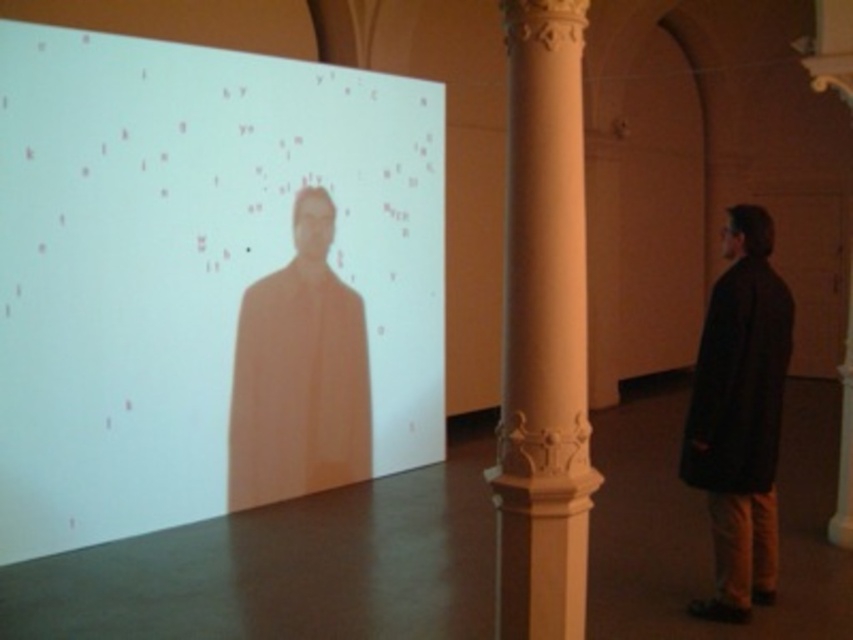
Question: Which object is farther from the camera taking this photo?

Choices:
 (A) white marble column at center
 (B) dark matte coat at right
 (C) white matte projection screen at upper left
 (D) matte orange coat at center

Answer: (D)

Question: Where is white matte projection screen at upper left located in relation to matte orange coat at center in the image?

Choices:
 (A) right
 (B) left

Answer: (B)

Question: Based on their relative distances, which object is nearer to the dark matte coat at right?

Choices:
 (A) white marble column at center
 (B) matte orange coat at center

Answer: (A)

Question: Considering the relative positions of white matte projection screen at upper left and white marble pillar at center in the image provided, where is white matte projection screen at upper left located with respect to white marble pillar at center?

Choices:
 (A) left
 (B) right

Answer: (A)

Question: Can you confirm if white matte projection screen at upper left is positioned above white marble pillar at center?

Choices:
 (A) yes
 (B) no

Answer: (A)

Question: Which object is farther from the camera taking this photo?

Choices:
 (A) white marble pillar at center
 (B) dark matte coat at right
 (C) matte orange coat at center
 (D) white marble column at center

Answer: (C)